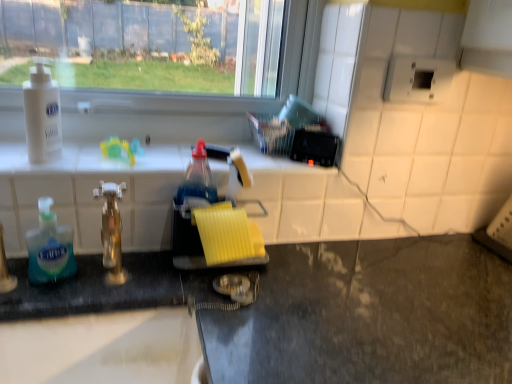
Locate an element on the screen. translucent plastic soap dispenser at left, arranged as the 1th bottle when ordered from the bottom is located at coordinates (50, 247).

In order to face black granite counter at lower left, should I rotate leftwards or rightwards?

A 7.677 degree turn to the left will do.

Where is `black granite counter at lower left`? The image size is (512, 384). black granite counter at lower left is located at coordinates (x=369, y=316).

Locate an element on the screen. Image resolution: width=512 pixels, height=384 pixels. yellow sponge at center is located at coordinates (216, 226).

From the picture: Is gold metallic faucet at center positioned with its back to translucent plastic soap dispenser at left, the 2th bottle positioned from the top?

gold metallic faucet at center is not turned away from translucent plastic soap dispenser at left, the 2th bottle positioned from the top.

Can you confirm if gold metallic faucet at center is taller than translucent plastic soap dispenser at left, the 2th bottle positioned from the top?

Correct, gold metallic faucet at center is much taller as translucent plastic soap dispenser at left, the 2th bottle positioned from the top.

Looking at the image, does gold metallic faucet at center seem bigger or smaller compared to translucent plastic soap dispenser at left, arranged as the 1th bottle when ordered from the bottom?

In the image, gold metallic faucet at center appears to be larger than translucent plastic soap dispenser at left, arranged as the 1th bottle when ordered from the bottom.

Is yellow sponge at center looking in the opposite direction of translucent plastic soap dispenser at left, arranged as the 1th bottle when ordered from the bottom?

No.

From the image's perspective, is yellow sponge at center below translucent plastic soap dispenser at left, the 2th bottle positioned from the top?

No.

Can you tell me how much yellow sponge at center and translucent plastic soap dispenser at left, arranged as the 1th bottle when ordered from the bottom, differ in facing direction?

3.54 degrees separate the facing orientations of yellow sponge at center and translucent plastic soap dispenser at left, arranged as the 1th bottle when ordered from the bottom.

Which of these two, translucent plastic soap dispenser at left, arranged as the 1th bottle when ordered from the bottom, or white matte lotion at upper left, arranged as the first bottle when viewed from the top, is smaller?

Smaller between the two is translucent plastic soap dispenser at left, arranged as the 1th bottle when ordered from the bottom.

Is translucent plastic soap dispenser at left, arranged as the 1th bottle when ordered from the bottom, situated inside white matte lotion at upper left, arranged as the first bottle when viewed from the top, or outside?

translucent plastic soap dispenser at left, arranged as the 1th bottle when ordered from the bottom, cannot be found inside white matte lotion at upper left, arranged as the first bottle when viewed from the top.

This screenshot has height=384, width=512. In order to click on bottle below the white matte lotion at upper left, which ranks as the 2th bottle in bottom-to-top order (from the image's perspective) in this screenshot , I will do `click(50, 247)`.

Between white matte lotion at upper left, arranged as the first bottle when viewed from the top, and white plastic outlet at upper right, which one is positioned behind?

Positioned behind is white plastic outlet at upper right.

Could you tell me if white matte lotion at upper left, which ranks as the 2th bottle in bottom-to-top order, is turned towards white plastic outlet at upper right?

Yes, white matte lotion at upper left, which ranks as the 2th bottle in bottom-to-top order, is turned towards white plastic outlet at upper right.

Can you confirm if gold metallic faucet at center is positioned to the left of white matte lotion at upper left, arranged as the first bottle when viewed from the top?

In fact, gold metallic faucet at center is to the right of white matte lotion at upper left, arranged as the first bottle when viewed from the top.

Can you see gold metallic faucet at center touching white matte lotion at upper left, arranged as the first bottle when viewed from the top?

No, gold metallic faucet at center is not beside white matte lotion at upper left, arranged as the first bottle when viewed from the top.

Looking at this image, between gold metallic faucet at center and white matte lotion at upper left, which ranks as the 2th bottle in bottom-to-top order, which one has less height?

white matte lotion at upper left, which ranks as the 2th bottle in bottom-to-top order, is shorter.

Considering the sizes of objects gold metallic faucet at center and white matte lotion at upper left, arranged as the first bottle when viewed from the top, in the image provided, who is smaller, gold metallic faucet at center or white matte lotion at upper left, arranged as the first bottle when viewed from the top,?

With smaller size is white matte lotion at upper left, arranged as the first bottle when viewed from the top.

How much distance is there between white plastic outlet at upper right and black granite counter at lower left?

white plastic outlet at upper right is 52.65 centimeters away from black granite counter at lower left.

Does white plastic outlet at upper right turn towards black granite counter at lower left?

No, white plastic outlet at upper right is not facing towards black granite counter at lower left.

Which of these two, white plastic outlet at upper right or black granite counter at lower left, stands taller?

black granite counter at lower left.

The width and height of the screenshot is (512, 384). I want to click on sink behind the black granite counter at lower left, so click(x=216, y=226).

Which point is more forward, (495, 382) or (208, 184)?

Point (495, 382)

Who is taller, black granite counter at lower left or yellow sponge at center?

black granite counter at lower left.

Identify the location of tap in front of the translucent plastic soap dispenser at left, arranged as the 1th bottle when ordered from the bottom. (112, 232).

This screenshot has width=512, height=384. I want to click on sink on the right of the translucent plastic soap dispenser at left, the 2th bottle positioned from the top, so click(x=216, y=226).

Looking at this image, which object lies further to the anchor point translucent plastic soap dispenser at left, arranged as the 1th bottle when ordered from the bottom, white matte lotion at upper left, arranged as the first bottle when viewed from the top, or black granite counter at lower left?

black granite counter at lower left lies further to translucent plastic soap dispenser at left, arranged as the 1th bottle when ordered from the bottom, than the other object.

Based on their spatial positions, is yellow sponge at center or black granite counter at lower left further from white plastic outlet at upper right?

black granite counter at lower left lies further to white plastic outlet at upper right than the other object.

Considering their positions, is translucent plastic soap dispenser at left, the 2th bottle positioned from the top, positioned further to yellow sponge at center than black granite counter at lower left?

Based on the image, translucent plastic soap dispenser at left, the 2th bottle positioned from the top, appears to be further to yellow sponge at center.

Looking at the image, which one is located further to white matte lotion at upper left, arranged as the first bottle when viewed from the top, white plastic outlet at upper right or yellow sponge at center?

white plastic outlet at upper right is further to white matte lotion at upper left, arranged as the first bottle when viewed from the top.

Which object lies nearer to the anchor point gold metallic faucet at center, white matte lotion at upper left, arranged as the first bottle when viewed from the top, or translucent plastic soap dispenser at left, arranged as the 1th bottle when ordered from the bottom?

Based on the image, translucent plastic soap dispenser at left, arranged as the 1th bottle when ordered from the bottom, appears to be nearer to gold metallic faucet at center.

When comparing their distances from white matte lotion at upper left, arranged as the first bottle when viewed from the top, does gold metallic faucet at center or yellow sponge at center seem closer?

Based on the image, gold metallic faucet at center appears to be nearer to white matte lotion at upper left, arranged as the first bottle when viewed from the top.

Which object lies further to the anchor point black granite counter at lower left, white matte lotion at upper left, arranged as the first bottle when viewed from the top, or yellow sponge at center?

white matte lotion at upper left, arranged as the first bottle when viewed from the top.

Based on their spatial positions, is gold metallic faucet at center or white matte lotion at upper left, which ranks as the 2th bottle in bottom-to-top order, further from translucent plastic soap dispenser at left, arranged as the 1th bottle when ordered from the bottom?

The object further to translucent plastic soap dispenser at left, arranged as the 1th bottle when ordered from the bottom, is white matte lotion at upper left, which ranks as the 2th bottle in bottom-to-top order.

The width and height of the screenshot is (512, 384). Identify the location of bottle between white matte lotion at upper left, arranged as the first bottle when viewed from the top, and black granite counter at lower left in the up-down direction. (50, 247).

Find the location of a particular element. The width and height of the screenshot is (512, 384). tap between white matte lotion at upper left, arranged as the first bottle when viewed from the top, and yellow sponge at center is located at coordinates (112, 232).

Find the location of `tap between translucent plastic soap dispenser at left, arranged as the 1th bottle when ordered from the bottom, and yellow sponge at center`. tap between translucent plastic soap dispenser at left, arranged as the 1th bottle when ordered from the bottom, and yellow sponge at center is located at coordinates (112, 232).

This screenshot has width=512, height=384. Identify the location of sink situated between white matte lotion at upper left, arranged as the first bottle when viewed from the top, and white plastic outlet at upper right from left to right. (216, 226).